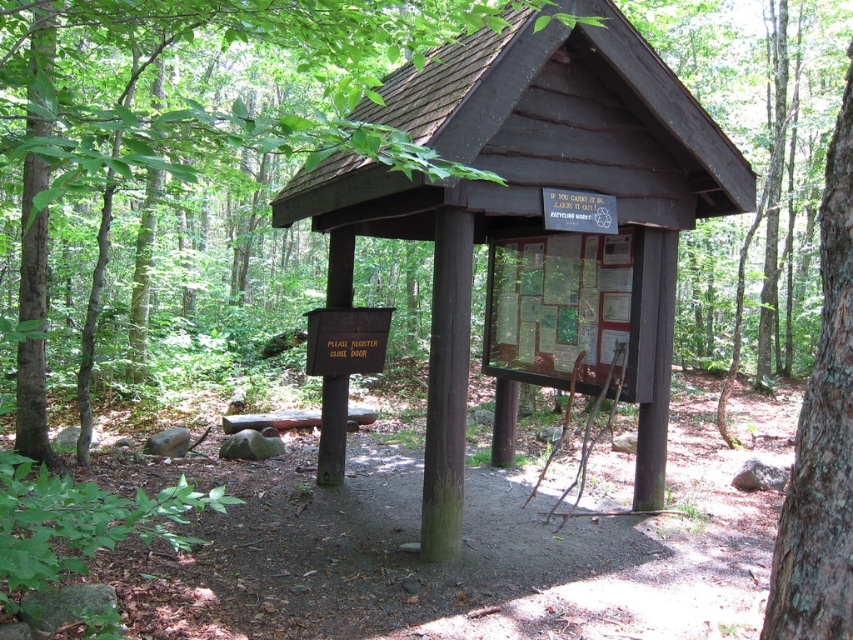
You are standing in front of the wooden structure in the forest. There is a point marked at coordinates (532, 209). What object is located at this point?

The point at coordinates (532, 209) corresponds to the dark brown wood sign at center.

In the scene shown: You are a hiker who wants to read the brown wood sign at center. However, you notice a brown rough bark tree at right. Is the tree blocking your view of the sign?

The brown rough bark tree at right is behind the brown wood sign at center, so it is not blocking your view of the sign.